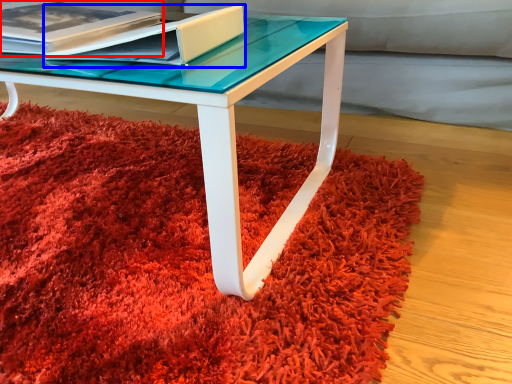
Question: Which of the following is the farthest to the observer, paperback book (highlighted by a red box) or paperback book (highlighted by a blue box)?

Choices:
 (A) paperback book
 (B) paperback book

Answer: (A)